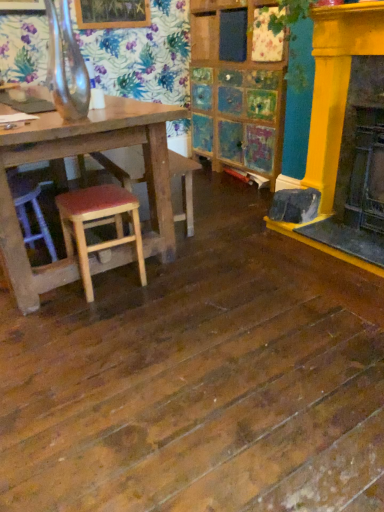
At what (x,y) coordinates should I click in order to perform the action: click on free spot to the right of wooden seat at center. Please return your answer as a coordinate pair (x, y). This screenshot has width=384, height=512. Looking at the image, I should click on click(241, 215).